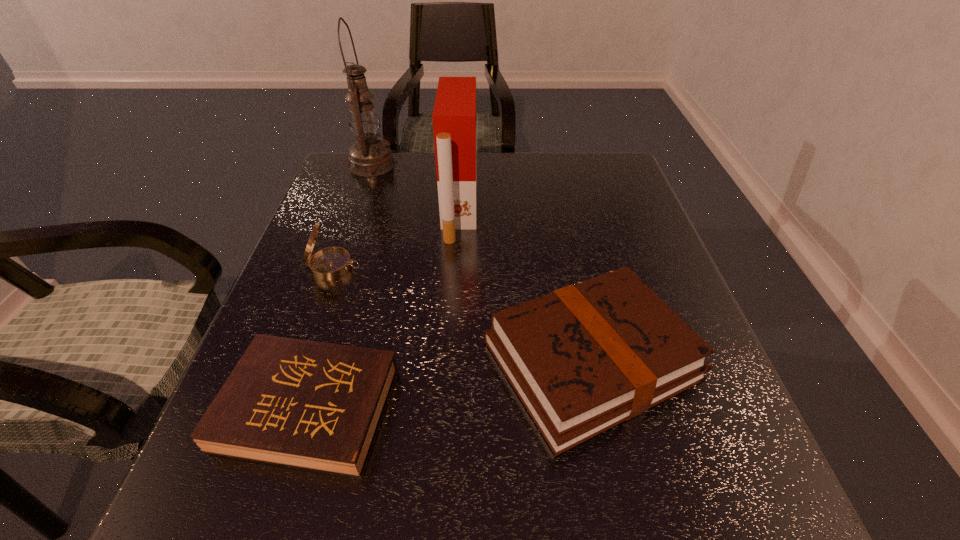
Identify the location of object that stands as the fourth closest to the oil lamp. This screenshot has height=540, width=960. (312, 405).

This screenshot has width=960, height=540. Find the location of `free space in the image that satisfies the following two spatial constraints: 1. with the dial facing the rightmost object; 2. on the right side of the compass`. free space in the image that satisfies the following two spatial constraints: 1. with the dial facing the rightmost object; 2. on the right side of the compass is located at coordinates (301, 360).

Locate an element on the screen. The image size is (960, 540). free point that satisfies the following two spatial constraints: 1. with the dial facing the compass; 2. on the back side of the rightmost object is located at coordinates (301, 360).

What are the coordinates of `vacant space that satisfies the following two spatial constraints: 1. on the front-facing side of the second farthest object; 2. on the back side of the fourth tallest object` in the screenshot? It's located at (451, 360).

The image size is (960, 540). I want to click on vacant space that satisfies the following two spatial constraints: 1. on the front-facing side of the taller hardback book; 2. on the left side of the second farthest object, so click(451, 360).

Find the location of `vacant position in the image that satisfies the following two spatial constraints: 1. with the dial facing the third farthest object; 2. on the back side of the shortest object`. vacant position in the image that satisfies the following two spatial constraints: 1. with the dial facing the third farthest object; 2. on the back side of the shortest object is located at coordinates (284, 409).